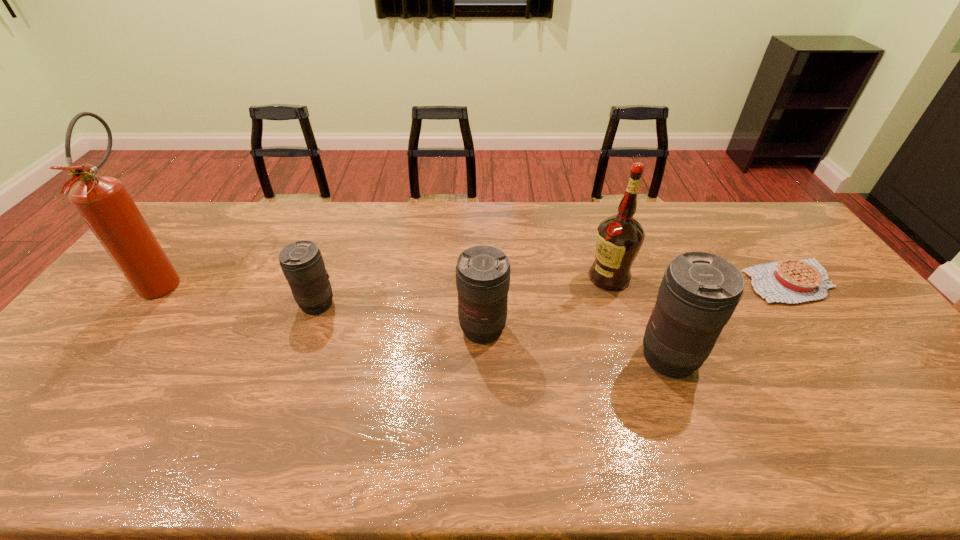
Please point a vacant point for placing a telephoto lens on the right. Please provide its 2D coordinates. Your answer should be formatted as a tuple, i.e. [(x, y)], where the tuple contains the x and y coordinates of a point satisfying the conditions above.

[(878, 389)]